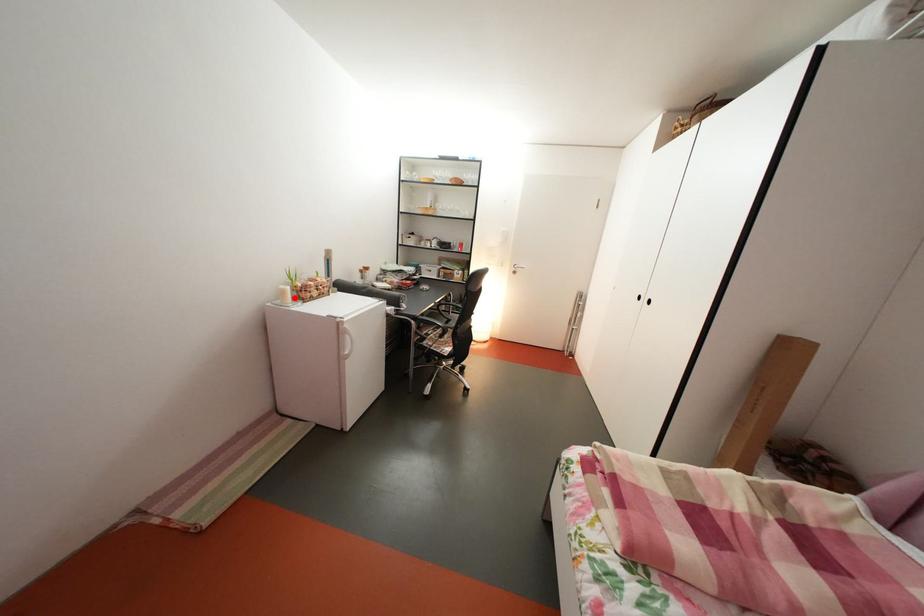
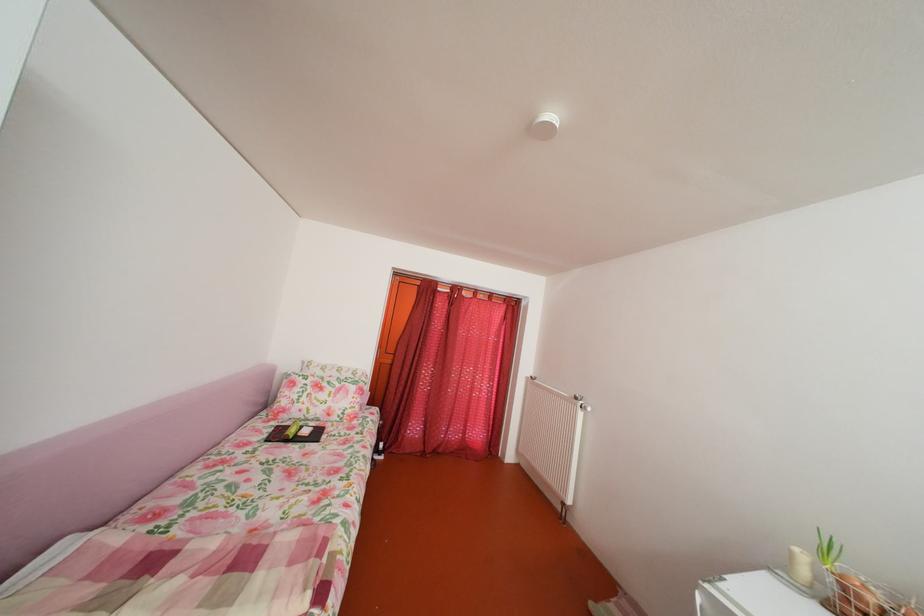
Find the pixel in the second image that matches the highlighted location in the first image.

(803, 561)